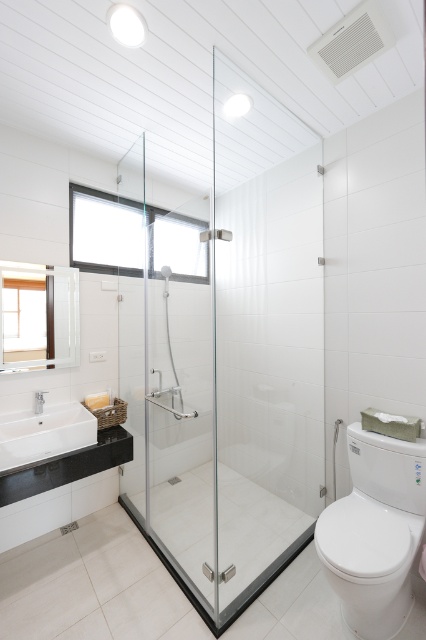
Question: In this image, where is transparent glass shower door at center located relative to transparent glass shower at center?

Choices:
 (A) left
 (B) right

Answer: (B)

Question: Considering the real-world distances, which object is farthest from the transparent glass shower at center?

Choices:
 (A) white glossy toilet at right
 (B) white glossy sink at lower left

Answer: (A)

Question: Is transparent glass shower door at center wider than transparent glass shower at center?

Choices:
 (A) no
 (B) yes

Answer: (B)

Question: Among these objects, which one is farthest from the camera?

Choices:
 (A) white glossy sink at lower left
 (B) transparent glass shower door at center
 (C) transparent glass shower at center
 (D) white glossy toilet at right

Answer: (C)

Question: Which point is farther from the camera taking this photo?

Choices:
 (A) (348, 502)
 (B) (255, 307)
 (C) (164, 285)

Answer: (C)

Question: Does transparent glass shower door at center have a smaller size compared to white glossy toilet at right?

Choices:
 (A) no
 (B) yes

Answer: (A)